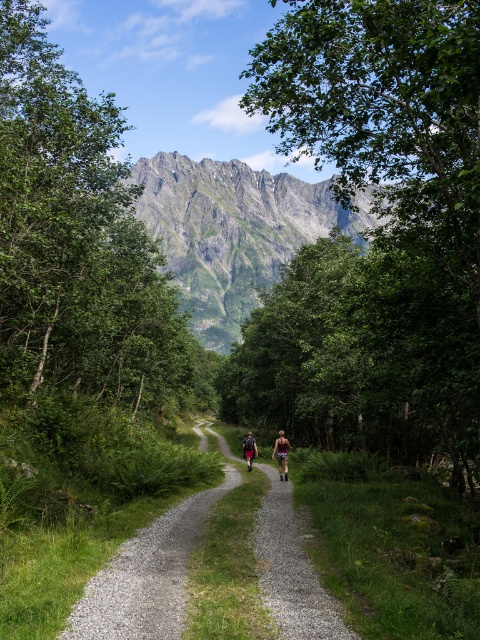
Question: Among these points, which one is nearest to the camera?

Choices:
 (A) (287, 477)
 (B) (73, 624)

Answer: (B)

Question: Observing the image, what is the correct spatial positioning of green grassy mountain at upper center in reference to gravel path at center?

Choices:
 (A) right
 (B) left

Answer: (B)

Question: Does gravel path at center appear on the right side of camouflage shorts at center?

Choices:
 (A) yes
 (B) no

Answer: (B)

Question: Which point is closer to the camera?

Choices:
 (A) gravel path at center
 (B) camouflage shorts at center
 (C) green grassy mountain at upper center

Answer: (A)

Question: Does gravel path at center have a smaller size compared to camouflage shorts at center?

Choices:
 (A) yes
 (B) no

Answer: (A)

Question: Among these points, which one is nearest to the camera?

Choices:
 (A) (263, 522)
 (B) (283, 448)
 (C) (228, 324)

Answer: (A)